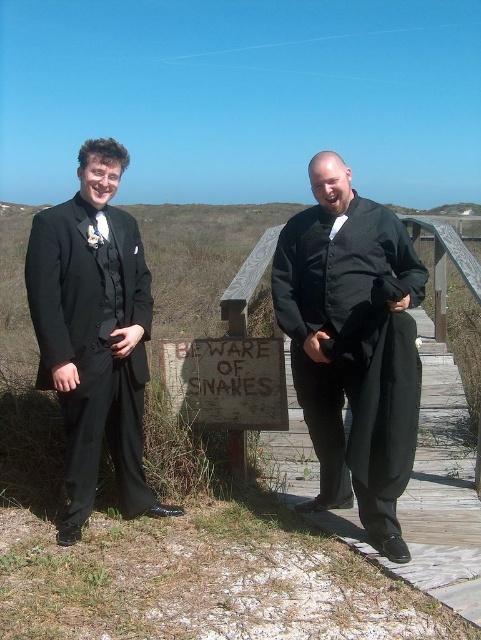
Question: Among these points, which one is nearest to the camera?

Choices:
 (A) (385, 348)
 (B) (201, 371)
 (C) (127, 500)

Answer: (A)

Question: Can you confirm if black satin suit at center is thinner than matte black suit at left?

Choices:
 (A) yes
 (B) no

Answer: (B)

Question: Among these objects, which one is farthest from the camera?

Choices:
 (A) matte black suit at left
 (B) weathered wooden sign at center
 (C) black satin suit at center

Answer: (B)

Question: Where is black satin suit at center located in relation to weathered wooden sign at center in the image?

Choices:
 (A) left
 (B) right

Answer: (B)

Question: Is matte black suit at left behind weathered wooden sign at center?

Choices:
 (A) yes
 (B) no

Answer: (B)

Question: Among these points, which one is farthest from the camera?

Choices:
 (A) (261, 387)
 (B) (349, 221)

Answer: (A)